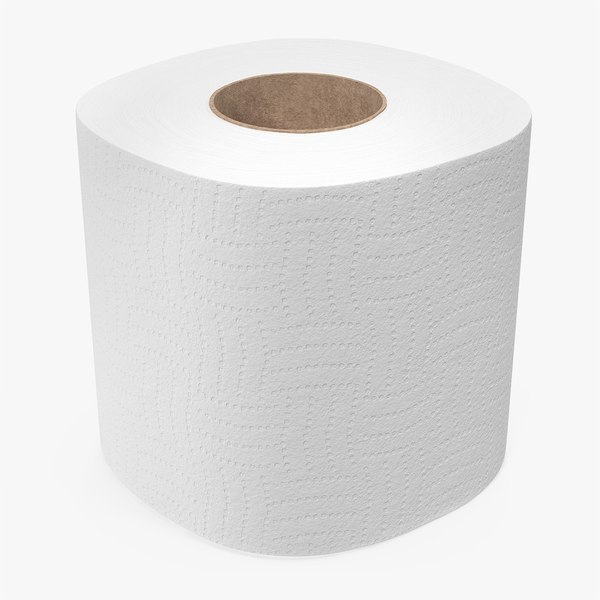
Where is `back top of toilet paper roll`? This screenshot has width=600, height=600. back top of toilet paper roll is located at coordinates (291, 53).